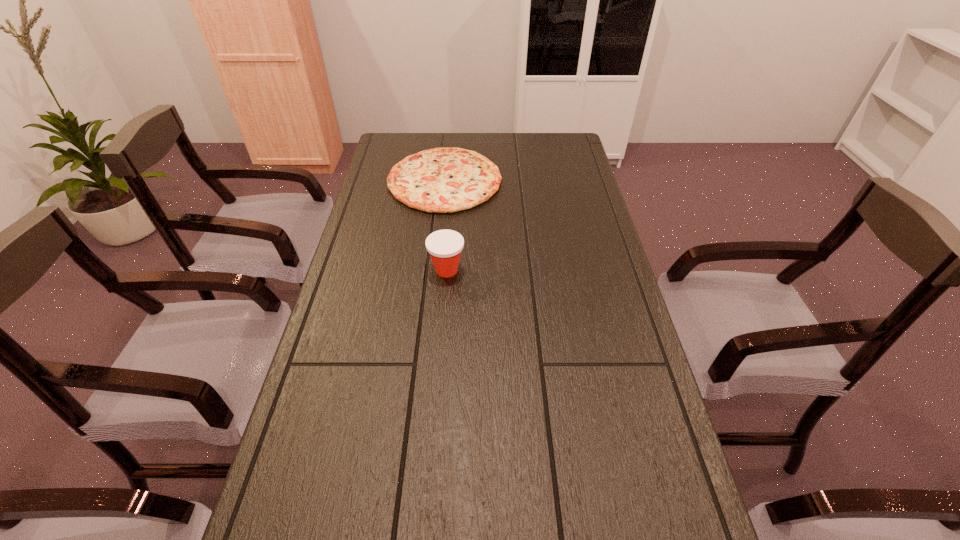
The width and height of the screenshot is (960, 540). I want to click on Dixie cup, so click(445, 246).

Identify the location of the taller object. Image resolution: width=960 pixels, height=540 pixels. coord(445,246).

Find the location of a particular element. The image size is (960, 540). the farther object is located at coordinates (441, 180).

Locate an element on the screen. The width and height of the screenshot is (960, 540). the shorter object is located at coordinates (441, 180).

Locate an element on the screen. The height and width of the screenshot is (540, 960). vacant space located 0.400m on the front of the Dixie cup is located at coordinates (436, 419).

At what (x,y) coordinates should I click in order to perform the action: click on blank space located 0.260m on the right of the farther object. Please return your answer as a coordinate pair (x, y). Looking at the image, I should click on (575, 180).

At what (x,y) coordinates should I click in order to perform the action: click on object that is at the far edge. Please return your answer as a coordinate pair (x, y). This screenshot has height=540, width=960. Looking at the image, I should click on (441, 180).

Identify the location of object that is at the left edge. (441, 180).

Find the location of `object that is at the far left corner`. object that is at the far left corner is located at coordinates (441, 180).

Identify the location of vacant space at the left edge. The height and width of the screenshot is (540, 960). (363, 357).